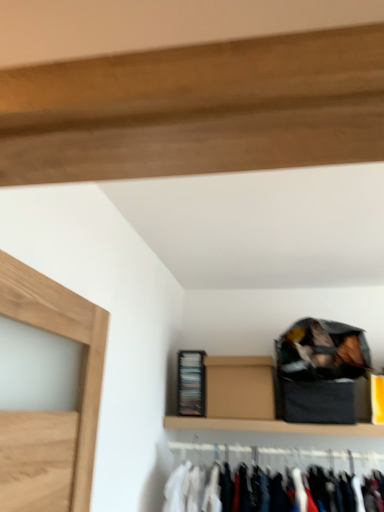
Question: Visually, is black plastic cabinet at lower center positioned to the left or to the right of brown cardboard box at upper center?

Choices:
 (A) right
 (B) left

Answer: (B)

Question: Relative to brown cardboard box at upper center, is black plastic cabinet at lower center in front or behind?

Choices:
 (A) behind
 (B) front

Answer: (A)

Question: Is black plastic cabinet at lower center wider or thinner than brown cardboard box at upper center?

Choices:
 (A) wide
 (B) thin

Answer: (B)

Question: From a real-world perspective, is brown cardboard box at upper center physically located above or below black plastic cabinet at lower center?

Choices:
 (A) above
 (B) below

Answer: (B)

Question: From the image's perspective, is brown cardboard box at upper center above or below black plastic cabinet at lower center?

Choices:
 (A) below
 (B) above

Answer: (B)

Question: Is brown cardboard box at upper center wider or thinner than black plastic cabinet at lower center?

Choices:
 (A) wide
 (B) thin

Answer: (A)

Question: Considering the positions of brown cardboard box at upper center and black plastic cabinet at lower center in the image, is brown cardboard box at upper center taller or shorter than black plastic cabinet at lower center?

Choices:
 (A) short
 (B) tall

Answer: (A)